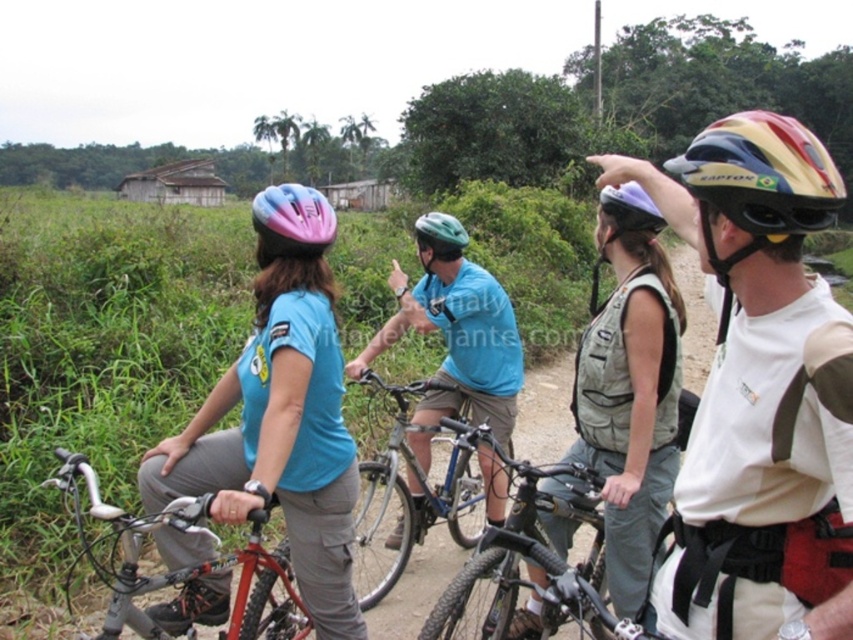
You are a safety inspector checking the helmets of cyclists in the image. The regulations state that helmets must not exceed 22 cm in width. You observe the matte purple bicycle helmet at upper center and the green matte bicycle helmet at center. Which helmet, if any, might violate the width regulation?

The matte purple bicycle helmet at upper center might be wider than the green matte bicycle helmet at center, so it could potentially violate the width regulation if its width exceeds 22 cm.

You are a photographer taking a picture of the matte blue shirt at center and the green matte bicycle helmet at center. Which object will appear larger in your photo?

The matte blue shirt at center will appear larger in the photo because it is closer to the viewer than the green matte bicycle helmet at center.